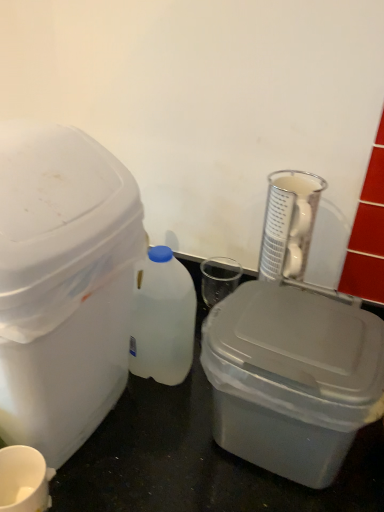
This screenshot has width=384, height=512. What do you see at coordinates (63, 284) in the screenshot?
I see `white plastic storage box at left, marked as the 2th storage box in a right-to-left arrangement` at bounding box center [63, 284].

Where is `clear glass beaker at upper right`? This screenshot has height=512, width=384. clear glass beaker at upper right is located at coordinates pos(289,223).

Locate an element on the screen. The width and height of the screenshot is (384, 512). white plastic bottle at center is located at coordinates (162, 319).

Could you tell me if gray plastic storage box at center, positioned as the 2th storage box in left-to-right order, is facing white plastic bottle at center?

No, gray plastic storage box at center, positioned as the 2th storage box in left-to-right order, does not turn towards white plastic bottle at center.

Is gray plastic storage box at center, positioned as the 2th storage box in left-to-right order, far from white plastic bottle at center?

No, gray plastic storage box at center, positioned as the 2th storage box in left-to-right order, is not far from white plastic bottle at center.

Looking at this image, from the image's perspective, which is above, gray plastic storage box at center, which is counted as the 1th storage box, starting from the right, or white plastic bottle at center?

white plastic bottle at center, from the image's perspective.

Which is more to the left, gray plastic storage box at center, which is counted as the 1th storage box, starting from the right, or white plastic bottle at center?

From the viewer's perspective, white plastic bottle at center appears more on the left side.

Is gray plastic storage box at center, positioned as the 2th storage box in left-to-right order, oriented towards white matte cup at lower left?

No, gray plastic storage box at center, positioned as the 2th storage box in left-to-right order, does not turn towards white matte cup at lower left.

Is gray plastic storage box at center, which is counted as the 1th storage box, starting from the right, inside or outside of white matte cup at lower left?

gray plastic storage box at center, which is counted as the 1th storage box, starting from the right, is located beyond the bounds of white matte cup at lower left.

Which is behind, gray plastic storage box at center, which is counted as the 1th storage box, starting from the right, or white matte cup at lower left?

white matte cup at lower left is further away from the camera.

Measure the distance from gray plastic storage box at center, which is counted as the 1th storage box, starting from the right, to white matte cup at lower left.

13.84 inches.

Is clear glass beaker at upper right looking in the opposite direction of white matte cup at lower left?

No, clear glass beaker at upper right is not facing the opposite direction of white matte cup at lower left.

Considering the sizes of objects clear glass beaker at upper right and white matte cup at lower left in the image provided, who is wider, clear glass beaker at upper right or white matte cup at lower left?

clear glass beaker at upper right is wider.

Would you say clear glass beaker at upper right is inside or outside white matte cup at lower left?

clear glass beaker at upper right is located beyond the bounds of white matte cup at lower left.

Measure the distance from clear glass beaker at upper right to white matte cup at lower left.

They are 20.26 inches apart.

From the image's perspective, which one is positioned higher, clear glass beaker at upper right or white plastic storage box at left, the first storage box from the left?

clear glass beaker at upper right is shown above in the image.

Considering the relative sizes of clear glass beaker at upper right and white plastic storage box at left, marked as the 2th storage box in a right-to-left arrangement, in the image provided, is clear glass beaker at upper right smaller than white plastic storage box at left, marked as the 2th storage box in a right-to-left arrangement,?

Correct, clear glass beaker at upper right occupies less space than white plastic storage box at left, marked as the 2th storage box in a right-to-left arrangement.

Could you tell me if clear glass beaker at upper right is facing white plastic storage box at left, marked as the 2th storage box in a right-to-left arrangement?

No, clear glass beaker at upper right does not turn towards white plastic storage box at left, marked as the 2th storage box in a right-to-left arrangement.

Which is correct: clear glass beaker at upper right is inside white plastic storage box at left, marked as the 2th storage box in a right-to-left arrangement, or outside of it?

clear glass beaker at upper right is located beyond the bounds of white plastic storage box at left, marked as the 2th storage box in a right-to-left arrangement.

Is gray plastic storage box at center, positioned as the 2th storage box in left-to-right order, to the left or to the right of white plastic storage box at left, marked as the 2th storage box in a right-to-left arrangement, in the image?

gray plastic storage box at center, positioned as the 2th storage box in left-to-right order, is positioned on white plastic storage box at left, marked as the 2th storage box in a right-to-left arrangement,'s right side.

Are gray plastic storage box at center, which is counted as the 1th storage box, starting from the right, and white plastic storage box at left, marked as the 2th storage box in a right-to-left arrangement, far apart?

That's not correct — gray plastic storage box at center, which is counted as the 1th storage box, starting from the right, is a little close to white plastic storage box at left, marked as the 2th storage box in a right-to-left arrangement.

Based on the photo, is white plastic storage box at left, marked as the 2th storage box in a right-to-left arrangement, at the back of gray plastic storage box at center, which is counted as the 1th storage box, starting from the right?

gray plastic storage box at center, which is counted as the 1th storage box, starting from the right, does not have its back to white plastic storage box at left, marked as the 2th storage box in a right-to-left arrangement.

Which of these two, gray plastic storage box at center, positioned as the 2th storage box in left-to-right order, or white plastic storage box at left, marked as the 2th storage box in a right-to-left arrangement, is wider?

With larger width is white plastic storage box at left, marked as the 2th storage box in a right-to-left arrangement.

Is white plastic storage box at left, marked as the 2th storage box in a right-to-left arrangement, inside or outside of gray plastic storage box at center, which is counted as the 1th storage box, starting from the right?

white plastic storage box at left, marked as the 2th storage box in a right-to-left arrangement, is located beyond the bounds of gray plastic storage box at center, which is counted as the 1th storage box, starting from the right.

Based on the photo, is white plastic storage box at left, the first storage box from the left, bigger or smaller than gray plastic storage box at center, positioned as the 2th storage box in left-to-right order?

white plastic storage box at left, the first storage box from the left, is bigger than gray plastic storage box at center, positioned as the 2th storage box in left-to-right order.

Find the location of a particular element. storage box positioned vertically above the gray plastic storage box at center, which is counted as the 1th storage box, starting from the right (from a real-world perspective) is located at coordinates (63, 284).

From a real-world perspective, which object rests below the other?

gray plastic storage box at center, which is counted as the 1th storage box, starting from the right, from a real-world perspective.

From the image's perspective, which object appears higher, gray plastic storage box at center, positioned as the 2th storage box in left-to-right order, or clear glass beaker at upper right?

clear glass beaker at upper right is shown above in the image.

Considering the positions of objects gray plastic storage box at center, which is counted as the 1th storage box, starting from the right, and clear glass beaker at upper right in the image provided, who is behind, gray plastic storage box at center, which is counted as the 1th storage box, starting from the right, or clear glass beaker at upper right?

clear glass beaker at upper right is further away from the camera.

Is gray plastic storage box at center, which is counted as the 1th storage box, starting from the right, turned away from clear glass beaker at upper right?

No, clear glass beaker at upper right is not at the back of gray plastic storage box at center, which is counted as the 1th storage box, starting from the right.

Locate an element on the screen. Image resolution: width=384 pixels, height=512 pixels. storage box that appears below the white plastic bottle at center (from a real-world perspective) is located at coordinates (292, 378).

The width and height of the screenshot is (384, 512). In order to click on coffee cup located on the left of gray plastic storage box at center, which is counted as the 1th storage box, starting from the right in this screenshot , I will do `click(24, 480)`.

Looking at the image, which one is located further to white matte cup at lower left, clear glass beaker at upper right or white plastic bottle at center?

Among the two, clear glass beaker at upper right is located further to white matte cup at lower left.

Which object lies nearer to the anchor point clear glass beaker at upper right, white matte cup at lower left or white plastic storage box at left, the first storage box from the left?

white plastic storage box at left, the first storage box from the left.

Estimate the real-world distances between objects in this image. Which object is closer to white matte cup at lower left, clear glass beaker at upper right or white plastic storage box at left, the first storage box from the left?

Based on the image, white plastic storage box at left, the first storage box from the left, appears to be nearer to white matte cup at lower left.

When comparing their distances from gray plastic storage box at center, positioned as the 2th storage box in left-to-right order, does white plastic bottle at center or white plastic storage box at left, the first storage box from the left, seem closer?

Among the two, white plastic bottle at center is located nearer to gray plastic storage box at center, positioned as the 2th storage box in left-to-right order.

Based on their spatial positions, is gray plastic storage box at center, positioned as the 2th storage box in left-to-right order, or white plastic bottle at center further from white matte cup at lower left?

gray plastic storage box at center, positioned as the 2th storage box in left-to-right order, lies further to white matte cup at lower left than the other object.

Considering their positions, is clear glass beaker at upper right positioned further to white plastic bottle at center than white matte cup at lower left?

white matte cup at lower left is positioned further to the anchor white plastic bottle at center.

From the image, which object appears to be farther from white plastic bottle at center, white matte cup at lower left or clear glass beaker at upper right?

white matte cup at lower left.

Considering their positions, is white plastic storage box at left, marked as the 2th storage box in a right-to-left arrangement, positioned closer to clear glass beaker at upper right than white matte cup at lower left?

Based on the image, white plastic storage box at left, marked as the 2th storage box in a right-to-left arrangement, appears to be nearer to clear glass beaker at upper right.

Find the location of `bottle between white plastic storage box at left, the first storage box from the left, and clear glass beaker at upper right from left to right`. bottle between white plastic storage box at left, the first storage box from the left, and clear glass beaker at upper right from left to right is located at coordinates (162, 319).

In order to click on bottle located between white matte cup at lower left and clear glass beaker at upper right in the left-right direction in this screenshot , I will do `click(162, 319)`.

Identify the location of coffee cup between white plastic storage box at left, marked as the 2th storage box in a right-to-left arrangement, and white plastic bottle at center in the front-back direction. (24, 480).

The height and width of the screenshot is (512, 384). Find the location of `coffee cup situated between white plastic storage box at left, marked as the 2th storage box in a right-to-left arrangement, and gray plastic storage box at center, positioned as the 2th storage box in left-to-right order, from left to right`. coffee cup situated between white plastic storage box at left, marked as the 2th storage box in a right-to-left arrangement, and gray plastic storage box at center, positioned as the 2th storage box in left-to-right order, from left to right is located at coordinates (24, 480).